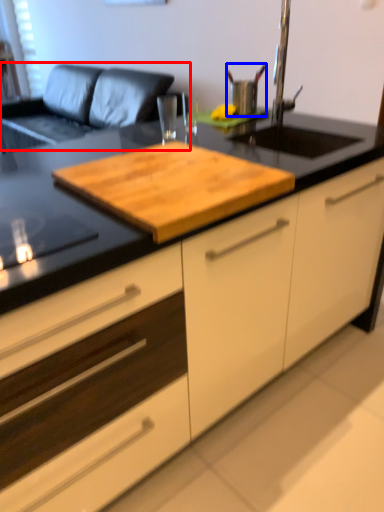
Question: Which object is further to the camera taking this photo, couch (highlighted by a red box) or appliance (highlighted by a blue box)?

Choices:
 (A) couch
 (B) appliance

Answer: (A)